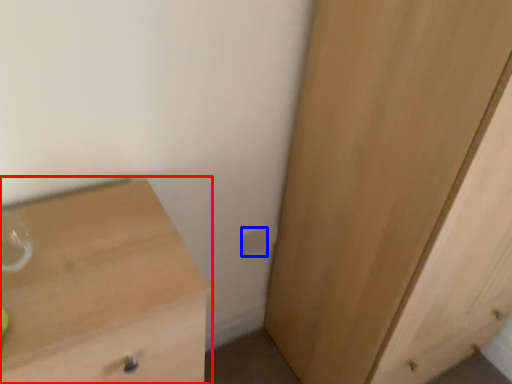
Question: Which of the following is the closest to the observer, chest of drawers (highlighted by a red box) or electric outlet (highlighted by a blue box)?

Choices:
 (A) chest of drawers
 (B) electric outlet

Answer: (A)